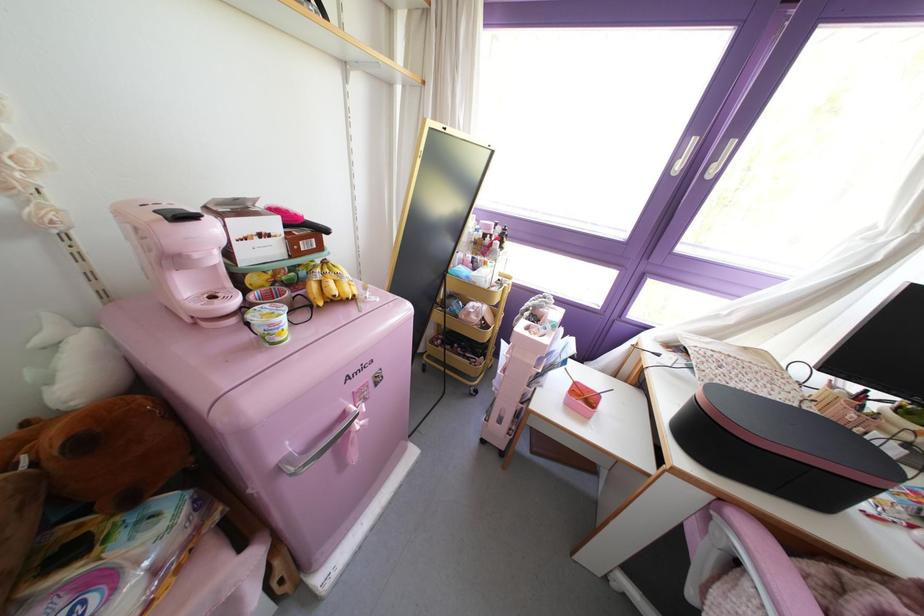
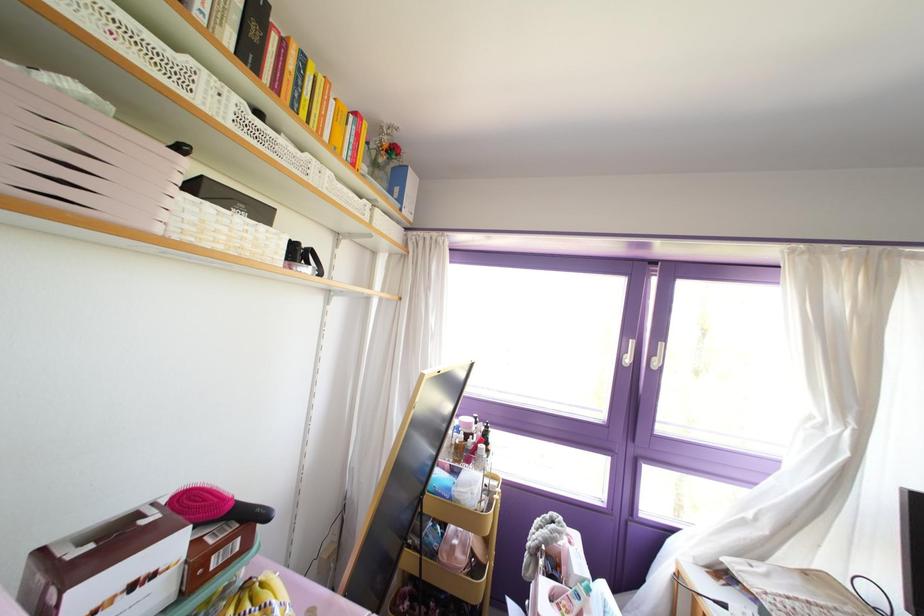
Find the pixel in the second image that matches point 677,167 in the first image.

(626, 360)